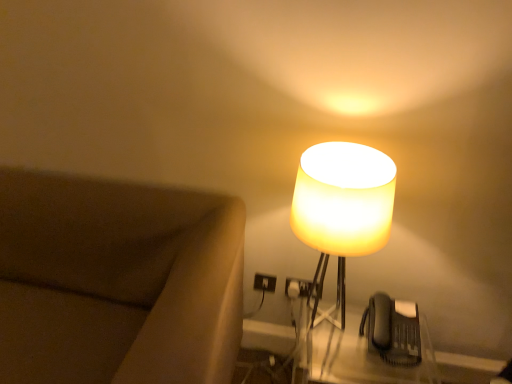
Question: Visually, is black plastic phone at lower right positioned to the left or to the right of translucent plastic table at lower right?

Choices:
 (A) left
 (B) right

Answer: (B)

Question: Looking at their shapes, would you say black plastic phone at lower right is wider or thinner than translucent plastic table at lower right?

Choices:
 (A) wide
 (B) thin

Answer: (B)

Question: Which is nearer to the translucent yellow glass lampshade at right?

Choices:
 (A) black plastic phone at lower right
 (B) translucent plastic table at lower right
 (C) brown fabric couch at left

Answer: (A)

Question: Which object is the farthest from the translucent plastic table at lower right?

Choices:
 (A) translucent yellow glass lampshade at right
 (B) brown fabric couch at left
 (C) black plastic phone at lower right

Answer: (B)